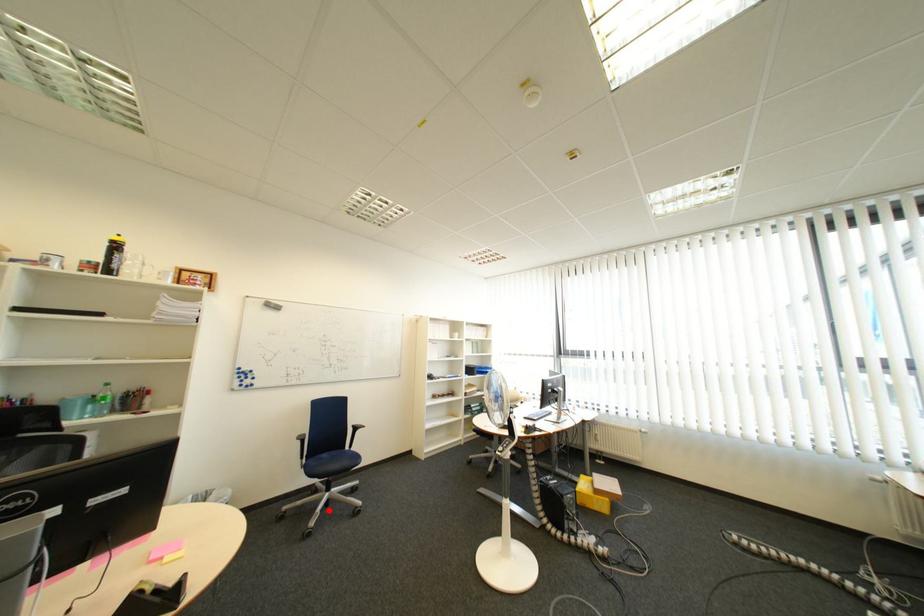
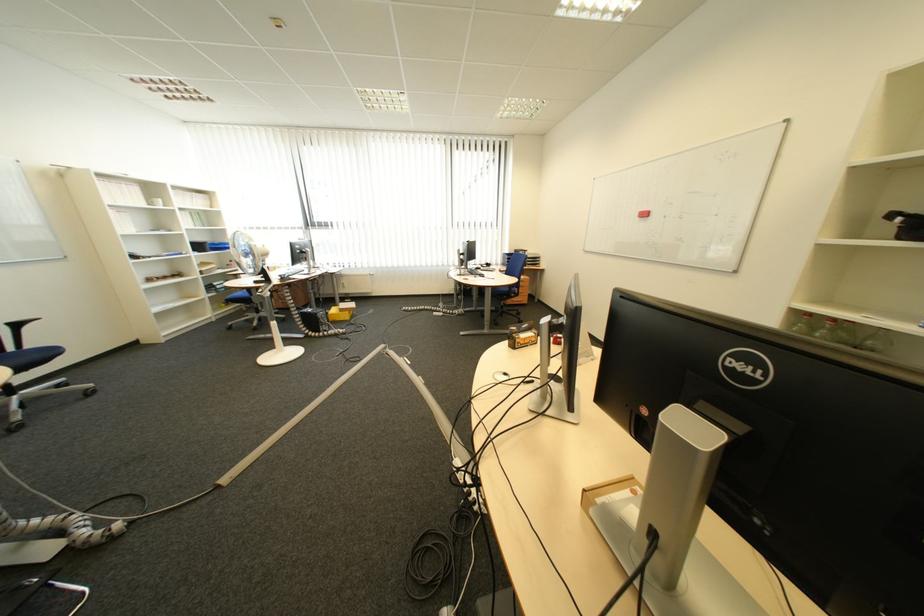
Question: A red point is marked in image1. In image2, is the corresponding 3D point closer to the camera or farther? Reply with the corresponding letter.

Choices:
 (A) The corresponding 3D point is closer.
 (B) The corresponding 3D point is farther.

Answer: (B)